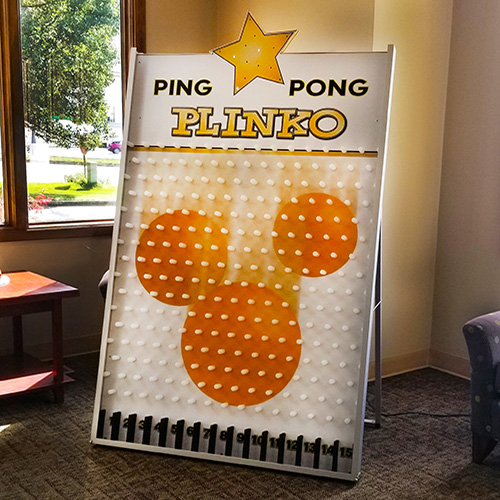
I want to click on shelf under side table, so click(x=19, y=382).